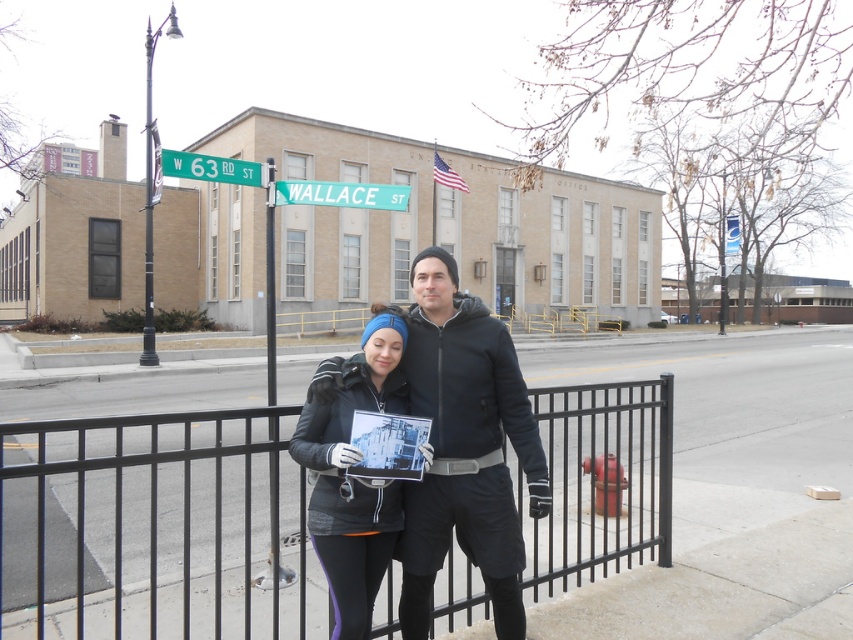
You are a delivery person trying to locate the address on W 63RD ST. You see the matte black jacket at center and the green metallic street sign at upper left. Which object is positioned higher up in the image?

The green metallic street sign at upper left is positioned higher up in the image than the matte black jacket at center.

Consider the image. You are a delivery person trying to locate the matte black jacket at center and the teal plastic street sign at upper center. Based on the scene description, which object is located to the right of the other?

The matte black jacket at center is positioned on the right side of the teal plastic street sign at upper center.

You are a delivery person at the intersection of W 63RD ST and WALLACE ST. You need to deliver a package to the beige building with the American flag. The building has two points marked on its facade. The first point is at coordinates point (x=476, y=317) and the second is at point (x=254, y=164). Which point is closer to the delivery entrance located at the central entrance flanked by the building?

Point (x=476, y=317) is in front of point (x=254, y=164), so the delivery entrance is likely closer to point (x=476, y=317) since it is positioned in front of the other point.